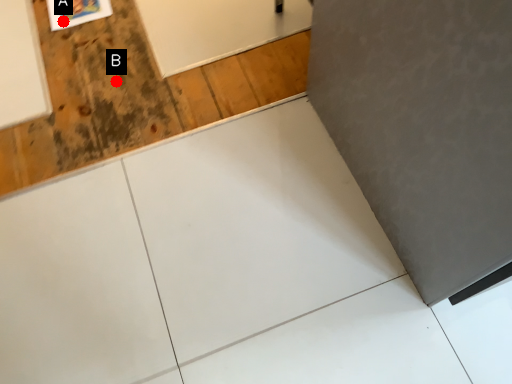
Question: Two points are circled on the image, labeled by A and B beside each circle. Among these points, which one is nearest to the camera?

Choices:
 (A) A is closer
 (B) B is closer

Answer: (B)